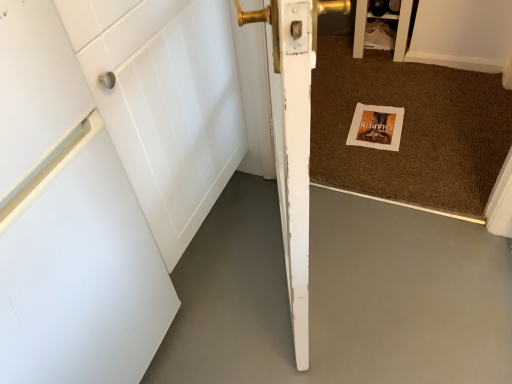
Question: Considering the positions of point (287, 41) and point (320, 329), is point (287, 41) closer or farther from the camera than point (320, 329)?

Choices:
 (A) closer
 (B) farther

Answer: (A)

Question: Is white matte door at center taller or shorter than white matte concrete at lower left?

Choices:
 (A) tall
 (B) short

Answer: (A)

Question: Estimate the real-world distances between objects in this image. Which object is closer to the white matte door at center?

Choices:
 (A) gold metallic door handle at upper center
 (B) matte white cabinet at upper right
 (C) brown woven mat at center
 (D) white paper postcard at center
 (E) white matte concrete at lower left

Answer: (E)

Question: Considering the real-world distances, which object is farthest from the matte white cabinet at upper right?

Choices:
 (A) gold metallic door handle at upper center
 (B) white matte door at center
 (C) white matte concrete at lower left
 (D) white paper postcard at center
 (E) brown woven mat at center

Answer: (B)